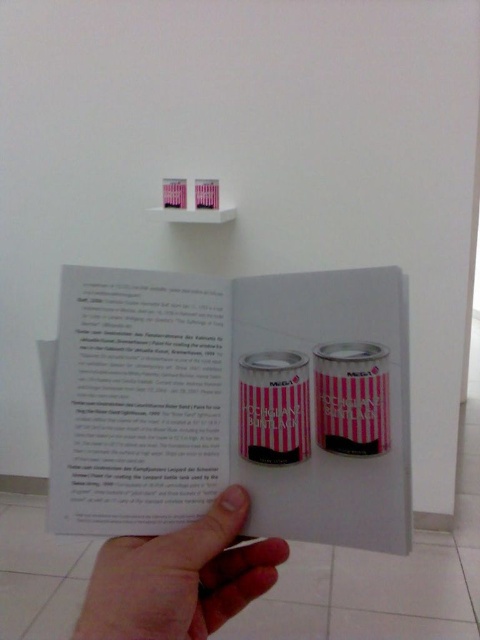
Question: Which object is farther from the camera taking this photo?

Choices:
 (A) flesh-toned skin at lower left
 (B) pink striped can at center
 (C) pink striped cans at center

Answer: (B)

Question: Which point is closer to the camera?

Choices:
 (A) pink striped can at center
 (B) pink striped cans at center

Answer: (B)

Question: Is pink striped cans at center smaller than pink striped can at center?

Choices:
 (A) no
 (B) yes

Answer: (A)

Question: Can you confirm if flesh-toned skin at lower left is positioned above pink striped can at center?

Choices:
 (A) yes
 (B) no

Answer: (B)

Question: Considering the relative positions of pink striped cans at center and flesh-toned skin at lower left in the image provided, where is pink striped cans at center located with respect to flesh-toned skin at lower left?

Choices:
 (A) below
 (B) above

Answer: (B)

Question: Which point is farther to the camera?

Choices:
 (A) (220, 557)
 (B) (363, 440)

Answer: (A)